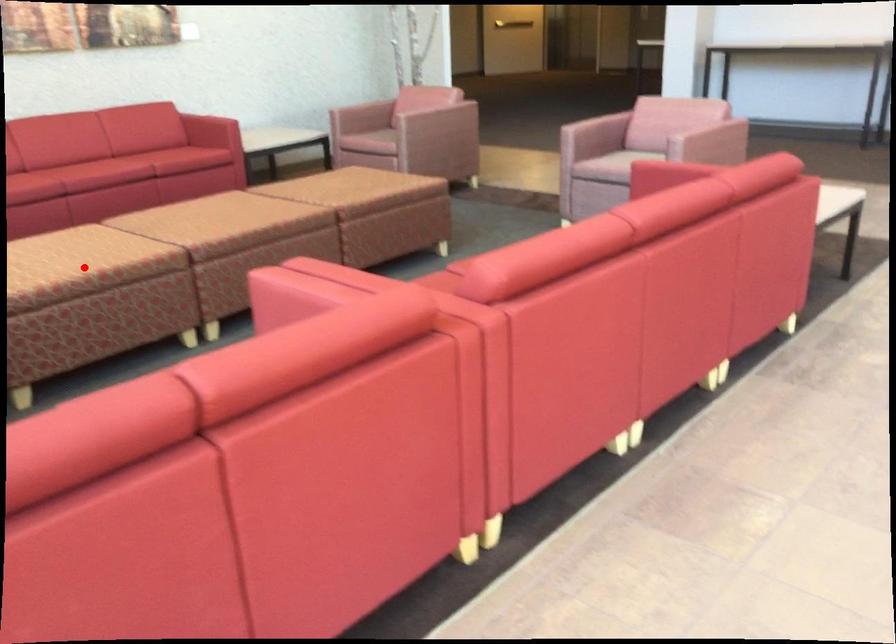
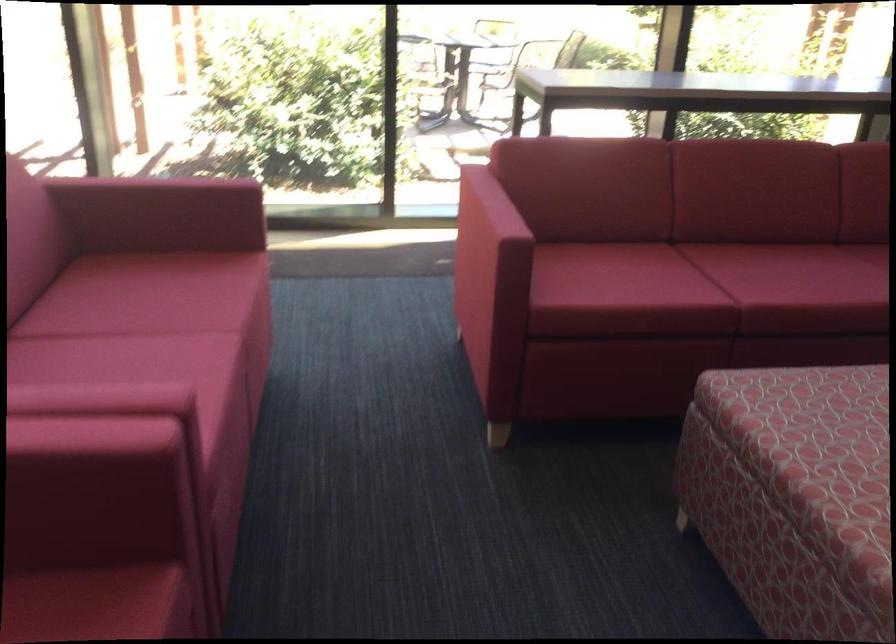
Question: A red point is marked in image1. In image2, is the corresponding 3D point closer to the camera or farther? Reply with the corresponding letter.

Choices:
 (A) The corresponding 3D point is closer.
 (B) The corresponding 3D point is farther.

Answer: (A)